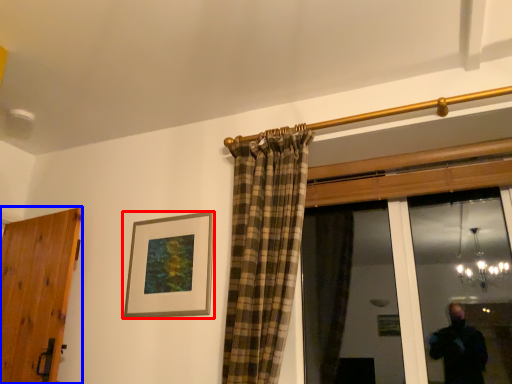
Question: Which object is closer to the camera taking this photo, picture frame (highlighted by a red box) or door (highlighted by a blue box)?

Choices:
 (A) picture frame
 (B) door

Answer: (B)